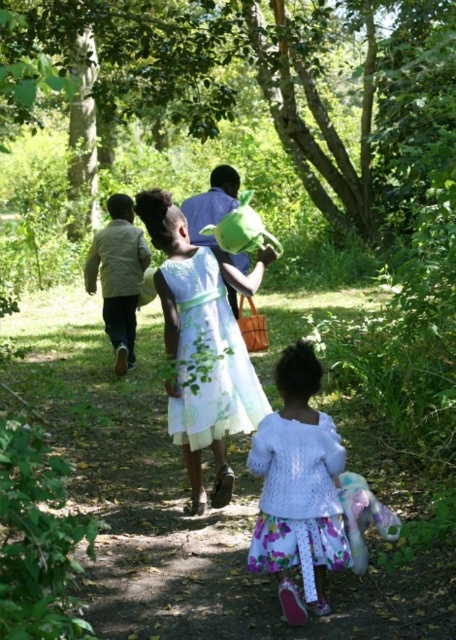
Question: Estimate the real-world distances between objects in this image. Which object is farther from the light green floral dress at center?

Choices:
 (A) light brown leather jacket at left
 (B) green leafy trees at center

Answer: (B)

Question: Is light green floral dress at center positioned in front of light brown leather jacket at left?

Choices:
 (A) yes
 (B) no

Answer: (A)

Question: Can you confirm if light green floral dress at center is positioned below light brown leather jacket at left?

Choices:
 (A) yes
 (B) no

Answer: (A)

Question: Does light green fabric dress at center have a greater width compared to white lace dress at center?

Choices:
 (A) no
 (B) yes

Answer: (B)

Question: Which object is positioned farthest from the white lace dress at center?

Choices:
 (A) light green floral dress at center
 (B) light green fabric dress at center

Answer: (A)

Question: Estimate the real-world distances between objects in this image. Which object is closer to the light green fabric dress at center?

Choices:
 (A) light green floral dress at center
 (B) white lace dress at center
 (C) light brown leather jacket at left

Answer: (A)